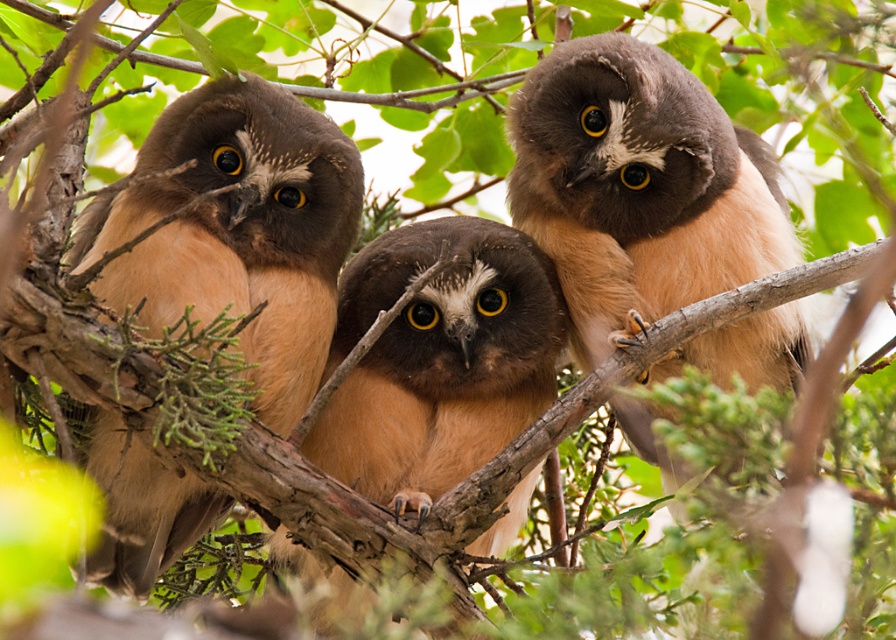
You are observing three owls on a branch. You notice two points marked as point 1 and point 2. Point 1 is at coordinate (306, 140) and point 2 is at (315, 580). Based on the scene, which point is closer to you?

Point 1 is closer to the camera than point 2.

You are a birdwatcher trying to measure the distance between the two owls without moving from your spot. Can you determine if the brown fuzzy owl at left is closer than 7 inches to the brown fluffy owl at center?

The distance between the brown fuzzy owl at left and the brown fluffy owl at center is 6.87 inches, which is less than 7 inches. Therefore, the brown fuzzy owl at left is indeed closer than 7 inches to the brown fluffy owl at center.